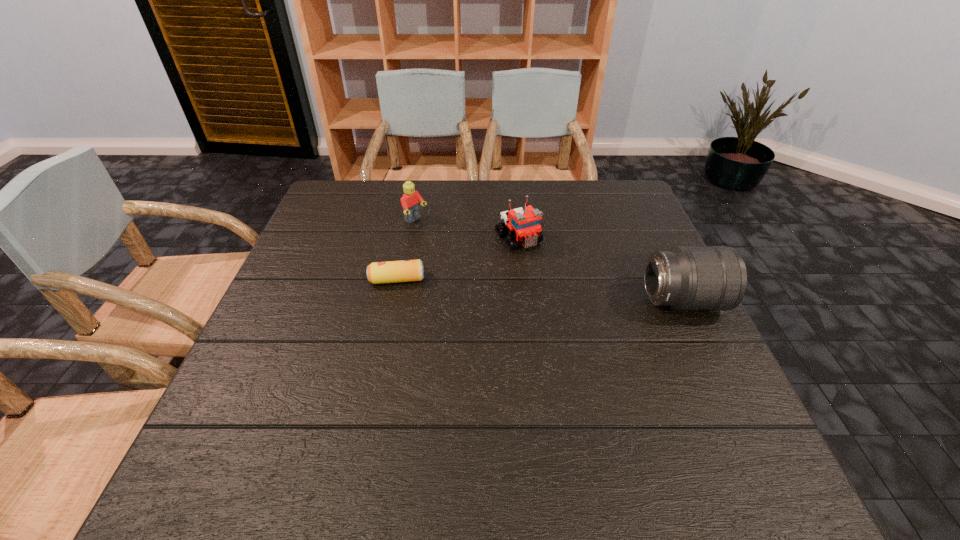
You are a GUI agent. You are given a task and a screenshot of the screen. Output one action in this format:
    pyautogui.click(x=<x>, y=<y>)
    Task: Click on the unoccupied position between the rightmost object and the beer can
    The height and width of the screenshot is (540, 960).
    Given the screenshot: What is the action you would take?
    pyautogui.click(x=540, y=291)

The image size is (960, 540). Find the location of `the second closest object to the right Lego`. the second closest object to the right Lego is located at coordinates (410, 201).

Image resolution: width=960 pixels, height=540 pixels. What are the coordinates of `object that stands as the closest to the third object from left to right` in the screenshot? It's located at (405, 270).

What are the coordinates of `vacant area in the image that satisfies the following two spatial constraints: 1. on the front side of the right Lego; 2. on the right side of the left Lego` in the screenshot? It's located at (412, 239).

Find the location of a particular element. free point that satisfies the following two spatial constraints: 1. on the front side of the right Lego; 2. on the left side of the left Lego is located at coordinates click(x=412, y=239).

The width and height of the screenshot is (960, 540). In order to click on free space that satisfies the following two spatial constraints: 1. on the back side of the left Lego; 2. on the right side of the shortest object in this screenshot , I will do `click(409, 221)`.

What are the coordinates of `vacant area that satisfies the following two spatial constraints: 1. on the front side of the rightmost object; 2. on the surface of the third object from left to right` in the screenshot? It's located at (525, 301).

Where is `vacant point that satisfies the following two spatial constraints: 1. on the front side of the right Lego; 2. on the surface of the tallest object`? Image resolution: width=960 pixels, height=540 pixels. vacant point that satisfies the following two spatial constraints: 1. on the front side of the right Lego; 2. on the surface of the tallest object is located at coordinates (525, 301).